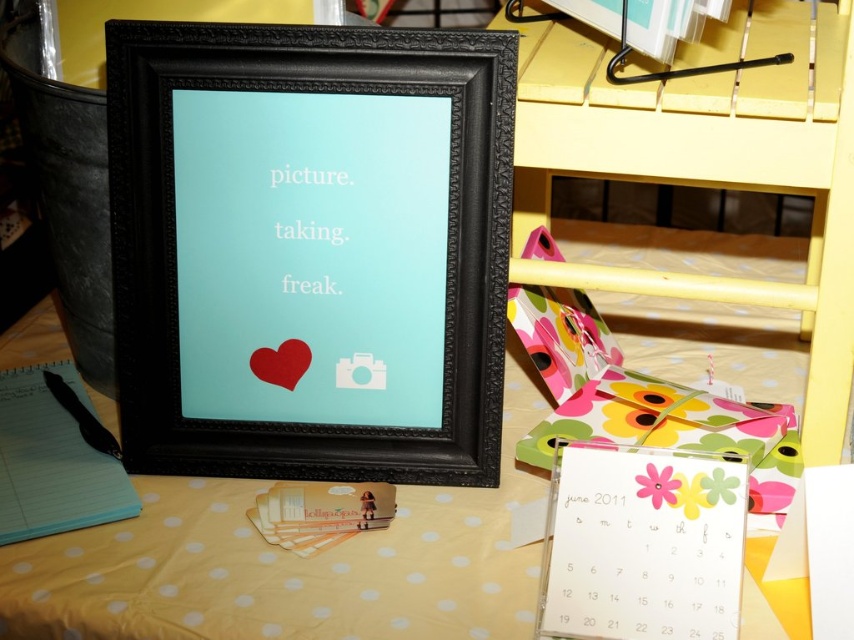
Can you confirm if white paper calendar at lower right is positioned below black matte pen at lower left?

Yes, white paper calendar at lower right is below black matte pen at lower left.

Describe the element at coordinates (642, 545) in the screenshot. The height and width of the screenshot is (640, 854). I see `white paper calendar at lower right` at that location.

Identify the location of white paper calendar at lower right. (642, 545).

Can you confirm if matte black frame at center is smaller than yellow wood bunk bed at lower right?

Correct, matte black frame at center occupies less space than yellow wood bunk bed at lower right.

This screenshot has height=640, width=854. Identify the location of matte black frame at center. (309, 250).

Between matte black frame at center and yellow dotted fabric at center, which one appears on the left side from the viewer's perspective?

matte black frame at center

Does matte black frame at center have a greater width compared to yellow dotted fabric at center?

No.

What do you see at coordinates (309, 250) in the screenshot? This screenshot has height=640, width=854. I see `matte black frame at center` at bounding box center [309, 250].

You are a GUI agent. You are given a task and a screenshot of the screen. Output one action in this format:
    pyautogui.click(x=<x>, y=<y>)
    Task: Click on the matte black frame at center
    
    Given the screenshot: What is the action you would take?
    pyautogui.click(x=309, y=250)